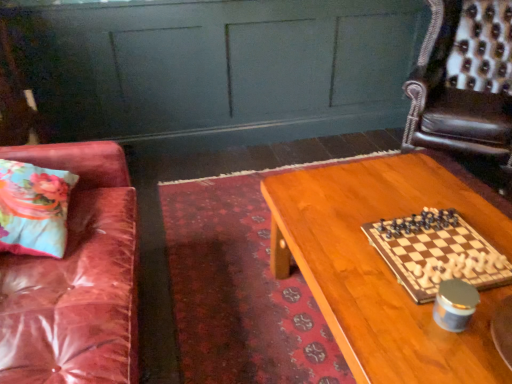
Question: From the image's perspective, is matte green dresser at upper center above or below floral fabric pillow at left?

Choices:
 (A) above
 (B) below

Answer: (A)

Question: From a real-world perspective, is matte green dresser at upper center above or below floral fabric pillow at left?

Choices:
 (A) below
 (B) above

Answer: (A)

Question: Based on their relative distances, which object is nearer to the matte green dresser at upper center?

Choices:
 (A) wooden chessboard at center
 (B) leather armchair at upper right
 (C) wooden table at center
 (D) floral fabric pillow at left

Answer: (B)

Question: Considering the real-world distances, which object is closest to the wooden table at center?

Choices:
 (A) wooden chessboard at center
 (B) leather armchair at upper right
 (C) matte green dresser at upper center
 (D) floral fabric pillow at left

Answer: (A)